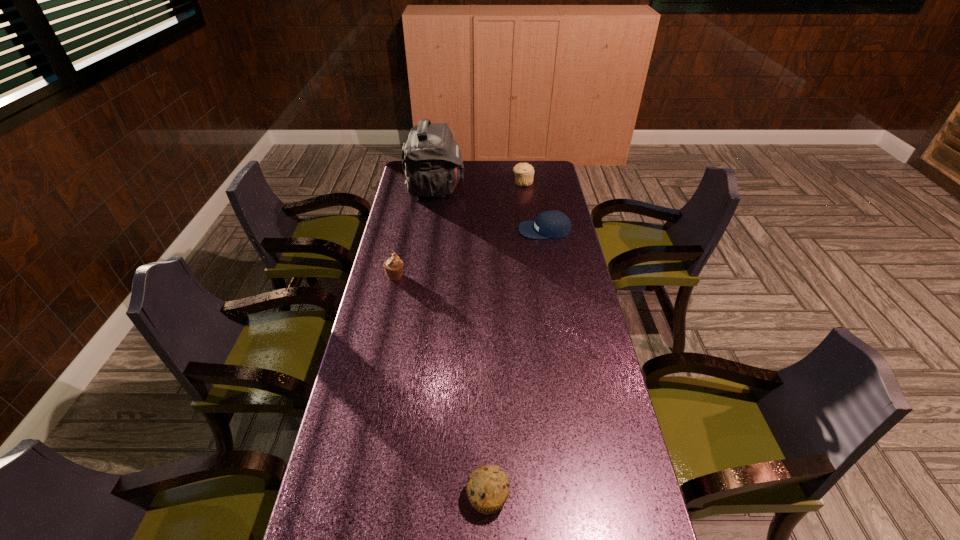
What are the coordinates of `object present at the far left corner` in the screenshot? It's located at (432, 161).

This screenshot has width=960, height=540. Identify the location of object present at the far right corner. (524, 172).

In the image, there is a desktop. Where is `vacant space at the far edge`? This screenshot has height=540, width=960. vacant space at the far edge is located at coordinates (507, 179).

Identify the location of vacant space at the left edge of the desktop. This screenshot has height=540, width=960. (331, 518).

Where is `vacant region at the right edge of the desktop`? The height and width of the screenshot is (540, 960). vacant region at the right edge of the desktop is located at coordinates (593, 359).

Find the location of `free spot between the nearest muffin and the second farthest muffin`. free spot between the nearest muffin and the second farthest muffin is located at coordinates (442, 386).

The height and width of the screenshot is (540, 960). What are the coordinates of `free spot between the rightmost muffin and the fourth farthest object` in the screenshot? It's located at (459, 229).

The image size is (960, 540). I want to click on empty space that is in between the shoulder bag and the farthest muffin, so click(479, 186).

Where is `vacant area between the third nearest object and the second muffin from left to right`? This screenshot has width=960, height=540. vacant area between the third nearest object and the second muffin from left to right is located at coordinates (516, 363).

This screenshot has height=540, width=960. Find the location of `free space between the third farthest object and the leftmost muffin`. free space between the third farthest object and the leftmost muffin is located at coordinates (469, 253).